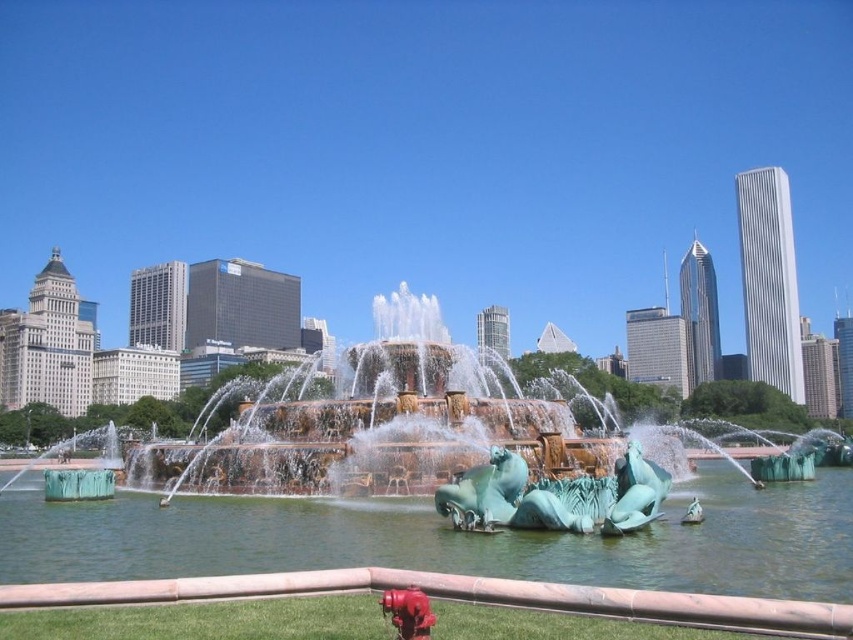
You are standing in the urban scene looking at the fountain and the city skyline. There are two points marked in the image. Which point is closer to you, point [831,588] or point [402,600]?

Point [831,588] is further to the viewer than point [402,600]. Therefore, point [402,600] is closer to you.